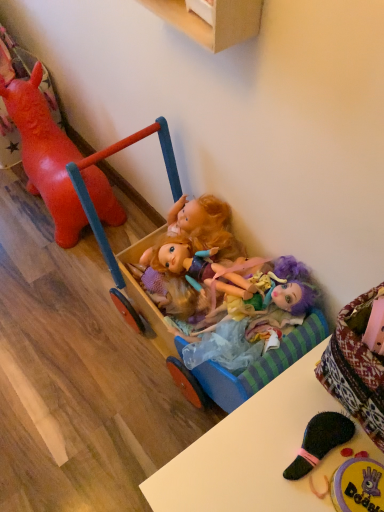
Question: From the image's perspective, is wooden toy carriage at center beneath multicolored fabric dolls at center?

Choices:
 (A) no
 (B) yes

Answer: (A)

Question: Does wooden toy carriage at center turn towards multicolored fabric dolls at center?

Choices:
 (A) no
 (B) yes

Answer: (B)

Question: Is wooden toy carriage at center outside multicolored fabric dolls at center?

Choices:
 (A) yes
 (B) no

Answer: (A)

Question: Considering the relative positions of wooden toy carriage at center and multicolored fabric dolls at center in the image provided, is wooden toy carriage at center to the left of multicolored fabric dolls at center from the viewer's perspective?

Choices:
 (A) no
 (B) yes

Answer: (B)

Question: From a real-world perspective, is wooden toy carriage at center on top of multicolored fabric dolls at center?

Choices:
 (A) no
 (B) yes

Answer: (A)

Question: Is wooden toy carriage at center positioned in front of multicolored fabric dolls at center?

Choices:
 (A) no
 (B) yes

Answer: (B)

Question: Can you confirm if wooden toy carriage at center is shorter than glossy plastic horse at left, acting as the 1th toy starting from the left?

Choices:
 (A) no
 (B) yes

Answer: (A)

Question: Is wooden toy carriage at center located outside glossy plastic horse at left, the second toy in the front-to-back sequence?

Choices:
 (A) yes
 (B) no

Answer: (A)

Question: From a real-world perspective, is wooden toy carriage at center positioned over glossy plastic horse at left, which is counted as the 1th toy, starting from the top, based on gravity?

Choices:
 (A) no
 (B) yes

Answer: (B)

Question: Is wooden toy carriage at center at the left side of glossy plastic horse at left, the second toy when ordered from bottom to top?

Choices:
 (A) yes
 (B) no

Answer: (B)

Question: Would you say glossy plastic horse at left, the second toy when ordered from bottom to top, is part of wooden toy carriage at center's contents?

Choices:
 (A) yes
 (B) no

Answer: (B)

Question: Are wooden toy carriage at center and glossy plastic horse at left, which is counted as the 1th toy, starting from the top, far apart?

Choices:
 (A) no
 (B) yes

Answer: (A)

Question: From a real-world perspective, is multicolored fabric dolls at center physically below wooden cabinet at upper center?

Choices:
 (A) yes
 (B) no

Answer: (A)